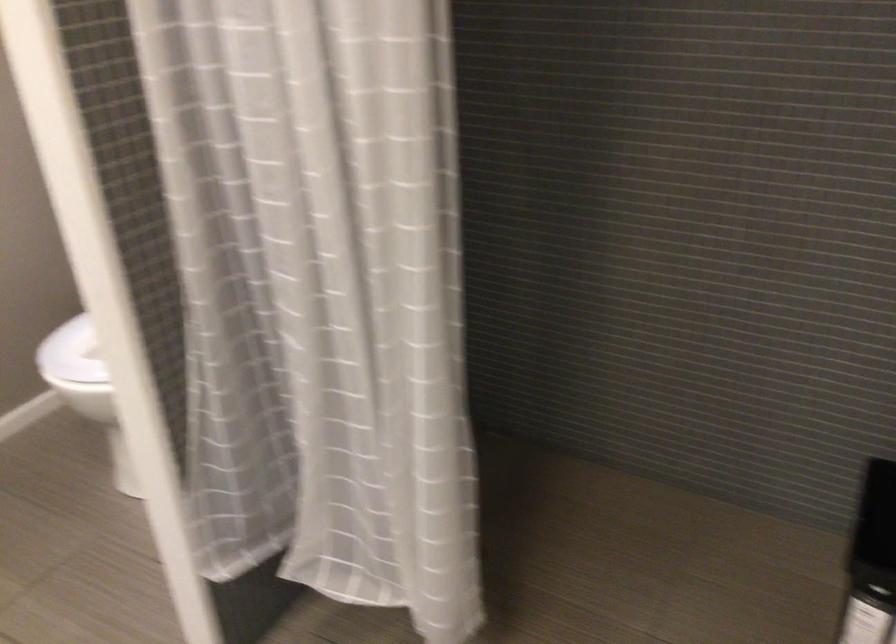
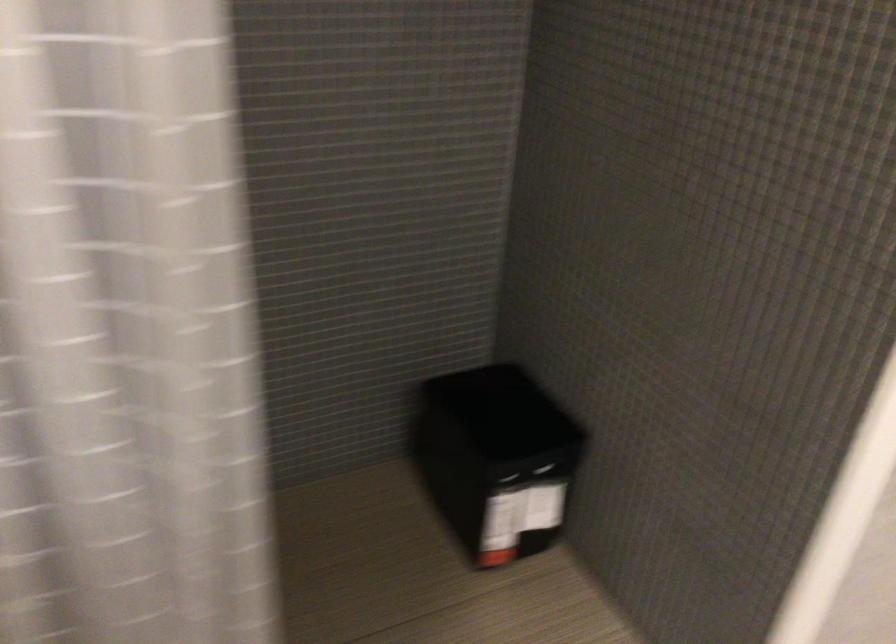
Question: The images are taken continuously from a first-person perspective. In which direction is your viewpoint rotating?

Choices:
 (A) Left
 (B) Right
 (C) Up
 (D) Down

Answer: (B)